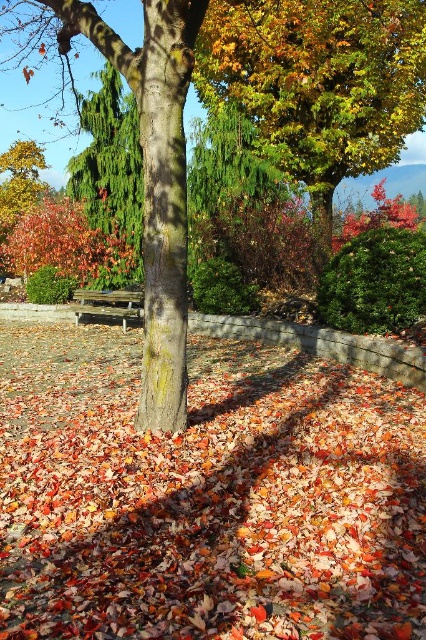
Looking at this image, does green textured evergreen tree at left appear under brown wooden bench at center?

Actually, green textured evergreen tree at left is above brown wooden bench at center.

At what (x,y) coordinates should I click in order to perform the action: click on green textured evergreen tree at left. Please return your answer as a coordinate pair (x, y). Looking at the image, I should click on (111, 176).

Is point (126, 218) farther from viewer compared to point (109, 305)?

Yes, point (126, 218) is behind point (109, 305).

You are a GUI agent. You are given a task and a screenshot of the screen. Output one action in this format:
    pyautogui.click(x=<x>, y=<y>)
    Task: Click on the green textured evergreen tree at left
    The image size is (426, 640).
    Given the screenshot: What is the action you would take?
    pyautogui.click(x=111, y=176)

Consider the image. Can you confirm if shiny green leaves at upper center is thinner than brown wooden bench at center?

Incorrect, shiny green leaves at upper center's width is not less than brown wooden bench at center's.

Consider the image. Is shiny green leaves at upper center positioned before brown wooden bench at center?

Yes, it is in front of brown wooden bench at center.

Describe the element at coordinates (317, 83) in the screenshot. I see `shiny green leaves at upper center` at that location.

This screenshot has height=640, width=426. I want to click on shiny green leaves at upper center, so click(x=317, y=83).

Who is positioned more to the left, shiny green leaves at upper center or green textured evergreen tree at left?

green textured evergreen tree at left

In the scene shown: Between shiny green leaves at upper center and green textured evergreen tree at left, which one is positioned higher?

Positioned higher is shiny green leaves at upper center.

Is point (213, 33) in front of point (135, 166)?

Yes, it is in front of point (135, 166).

The height and width of the screenshot is (640, 426). What are the coordinates of `shiny green leaves at upper center` in the screenshot? It's located at (317, 83).